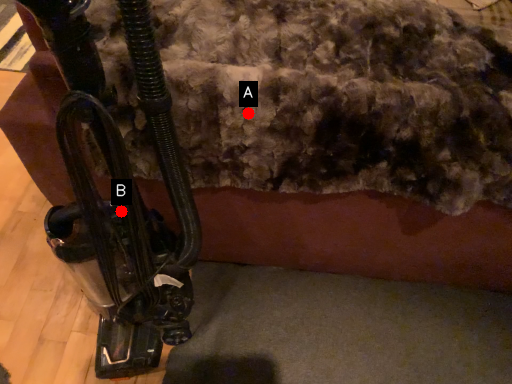
Question: Two points are circled on the image, labeled by A and B beside each circle. Which point is further to the camera?

Choices:
 (A) A is further
 (B) B is further

Answer: (B)